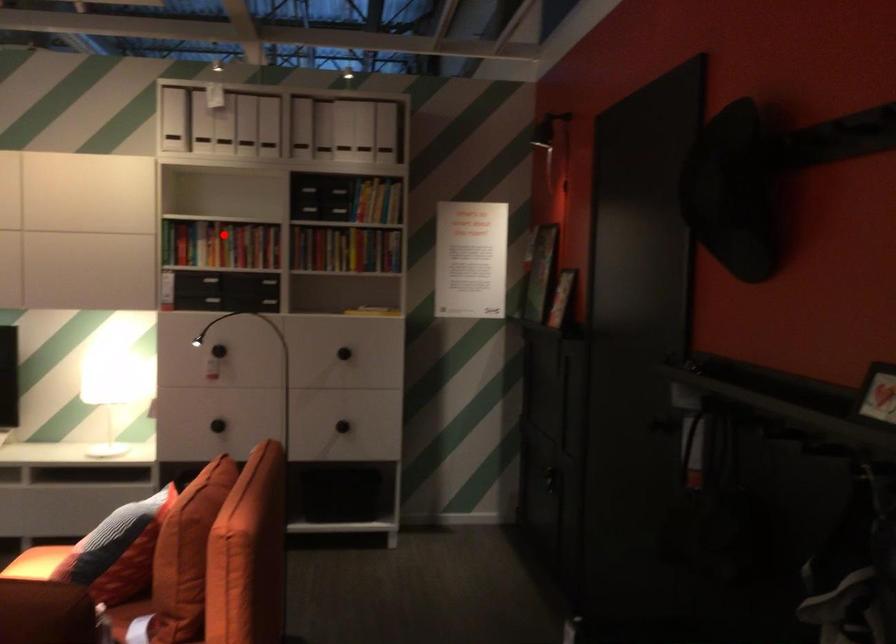
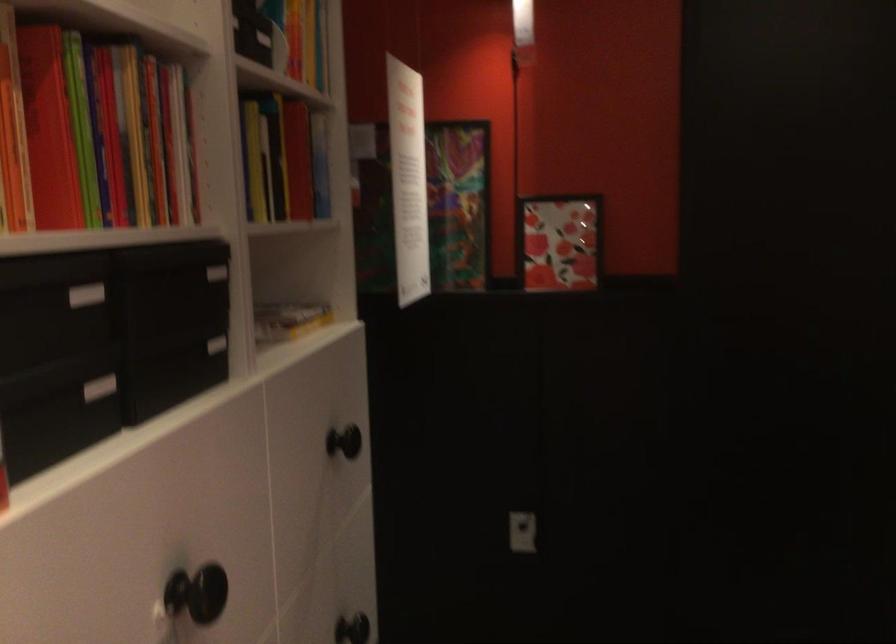
Question: I am providing you with two images of the same scene from different viewpoints. Given a red point in image1, look at the same physical point in image2. Is it:

Choices:
 (A) Closer to the viewpoint
 (B) Farther from the viewpoint

Answer: (A)